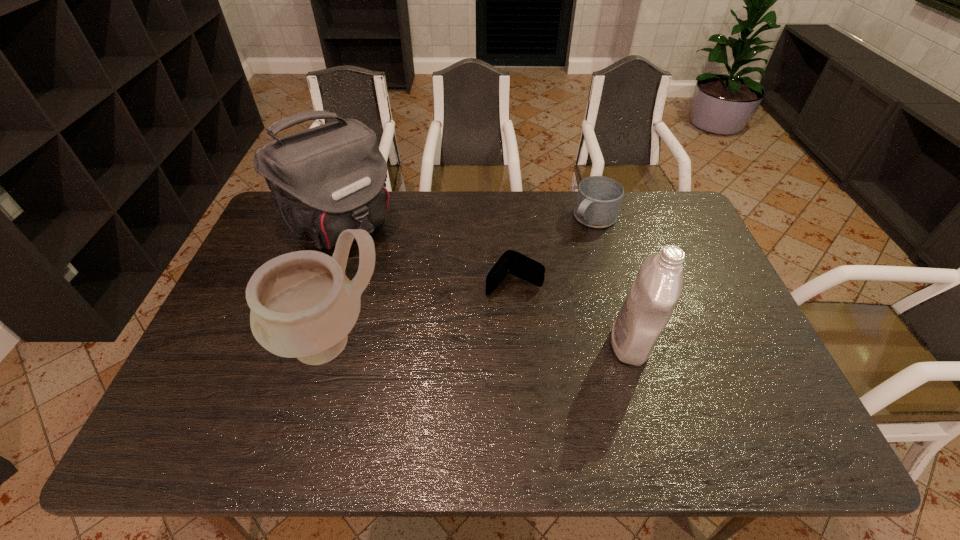
Where is `vacant space located on the side of the mug with the handle`? The width and height of the screenshot is (960, 540). vacant space located on the side of the mug with the handle is located at coordinates (543, 269).

The height and width of the screenshot is (540, 960). I want to click on vacant region located on the outer surface of the wallet, so click(446, 361).

Identify the location of free space located on the outer surface of the wallet. (468, 334).

Identify the location of vacant area situated on the outer surface of the wallet. The height and width of the screenshot is (540, 960). (482, 317).

Identify the location of vacant space located on the open flap of the tallest object. This screenshot has width=960, height=540. (441, 321).

Find the location of `free space located on the open flap of the tallest object`. free space located on the open flap of the tallest object is located at coordinates (429, 310).

In order to click on free location located 0.260m on the open flap of the tallest object in this screenshot , I will do `click(419, 300)`.

You are a GUI agent. You are given a task and a screenshot of the screen. Output one action in this format:
    pyautogui.click(x=<x>, y=<y>)
    Task: Click on the mug positioned at the far edge
    
    Given the screenshot: What is the action you would take?
    pyautogui.click(x=598, y=201)

Where is `shoulder bag that is at the far edge`? The height and width of the screenshot is (540, 960). shoulder bag that is at the far edge is located at coordinates (323, 180).

What are the coordinates of `object at the near edge` in the screenshot? It's located at (303, 306).